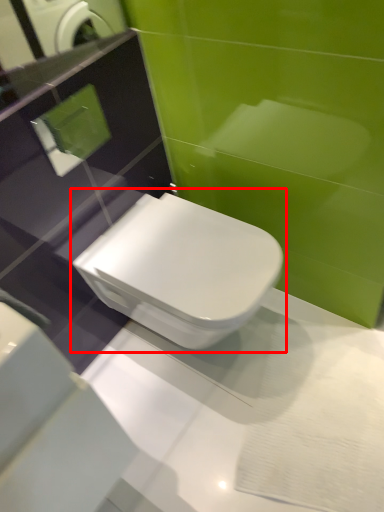
Question: Considering the relative positions of toilet (annotated by the red box) and mirror in the image provided, where is toilet (annotated by the red box) located with respect to the staircase?

Choices:
 (A) left
 (B) right

Answer: (B)